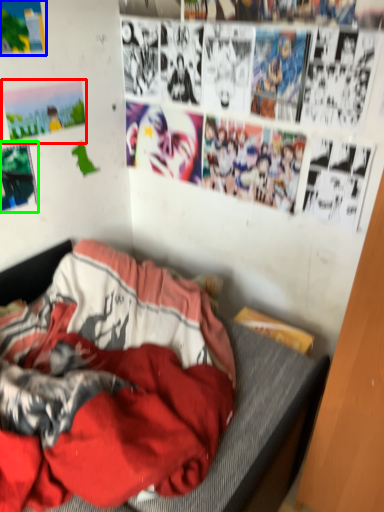
Question: Considering the real-world distances, which object is closest to poster page (highlighted by a red box)? poster page (highlighted by a blue box) or poster page (highlighted by a green box).

Choices:
 (A) poster page
 (B) poster page

Answer: (B)